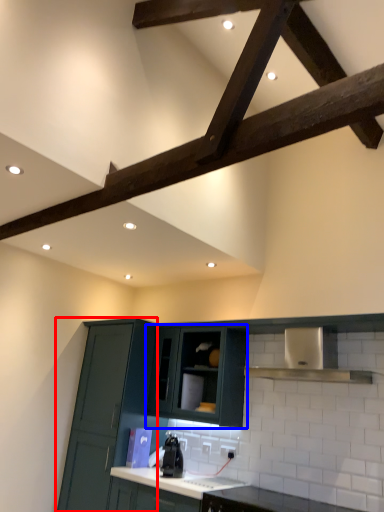
Question: Which of the following is the farthest to the observer, cabinetry (highlighted by a red box) or cabinetry (highlighted by a blue box)?

Choices:
 (A) cabinetry
 (B) cabinetry

Answer: (B)